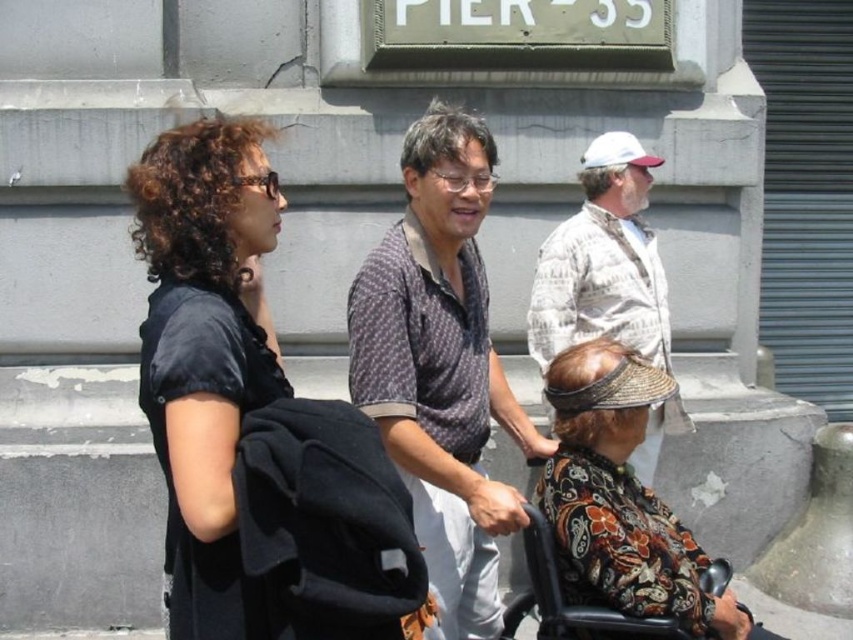
Does white textured shirt at upper right come behind black plastic wheelchair at lower right?

Yes, it is behind black plastic wheelchair at lower right.

Does white textured shirt at upper right appear on the left side of black plastic wheelchair at lower right?

Incorrect, white textured shirt at upper right is not on the left side of black plastic wheelchair at lower right.

Does point (643, 314) come in front of point (527, 593)?

No, (643, 314) is behind (527, 593).

At what (x,y) coordinates should I click in order to perform the action: click on white textured shirt at upper right. Please return your answer as a coordinate pair (x, y). Looking at the image, I should click on (602, 260).

From the picture: Who is more forward, (412,554) or (566,257)?

Point (412,554)

Consider the image. Which is above, black matte backpack at center or white textured shirt at upper right?

Positioned higher is white textured shirt at upper right.

Does point (189, 497) lie in front of point (628, 300)?

Yes, it is.

Find the location of a particular element. The image size is (853, 640). black matte backpack at center is located at coordinates coord(253,419).

Which is more to the right, black matte backpack at center or dotted fabric shirt at center?

Positioned to the right is dotted fabric shirt at center.

Image resolution: width=853 pixels, height=640 pixels. What do you see at coordinates (253, 419) in the screenshot?
I see `black matte backpack at center` at bounding box center [253, 419].

Where is `black matte backpack at center`? The width and height of the screenshot is (853, 640). black matte backpack at center is located at coordinates (253, 419).